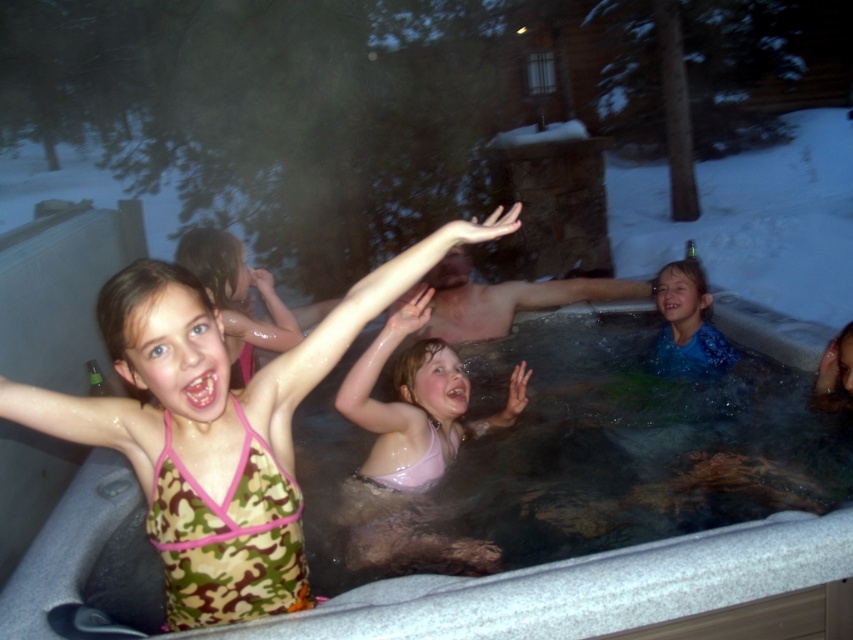
Question: Estimate the real-world distances between objects in this image. Which object is farther from the camouflage fabric swimsuit at upper left?

Choices:
 (A) blue patterned swimsuit at center
 (B) white textured hot tub at center
 (C) pink matte swimsuit at center

Answer: (A)

Question: Which point appears closest to the camera in this image?

Choices:
 (A) [834, 547]
 (B) [444, 390]

Answer: (A)

Question: Which of these objects is positioned closest to the camouflage fabric swimsuit at upper left?

Choices:
 (A) white textured hot tub at center
 (B) blue patterned swimsuit at center

Answer: (A)

Question: Is white textured hot tub at center in front of blue patterned swimsuit at center?

Choices:
 (A) no
 (B) yes

Answer: (B)

Question: Observing the image, what is the correct spatial positioning of white textured hot tub at center in reference to blue patterned swimsuit at center?

Choices:
 (A) above
 (B) below

Answer: (B)

Question: Is white textured hot tub at center positioned at the back of pink matte swimsuit at center?

Choices:
 (A) no
 (B) yes

Answer: (A)